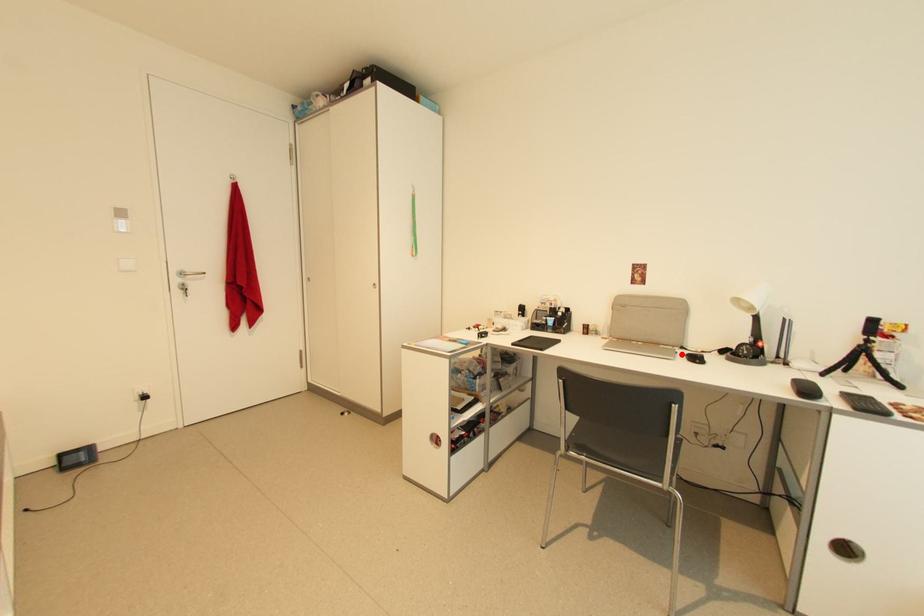
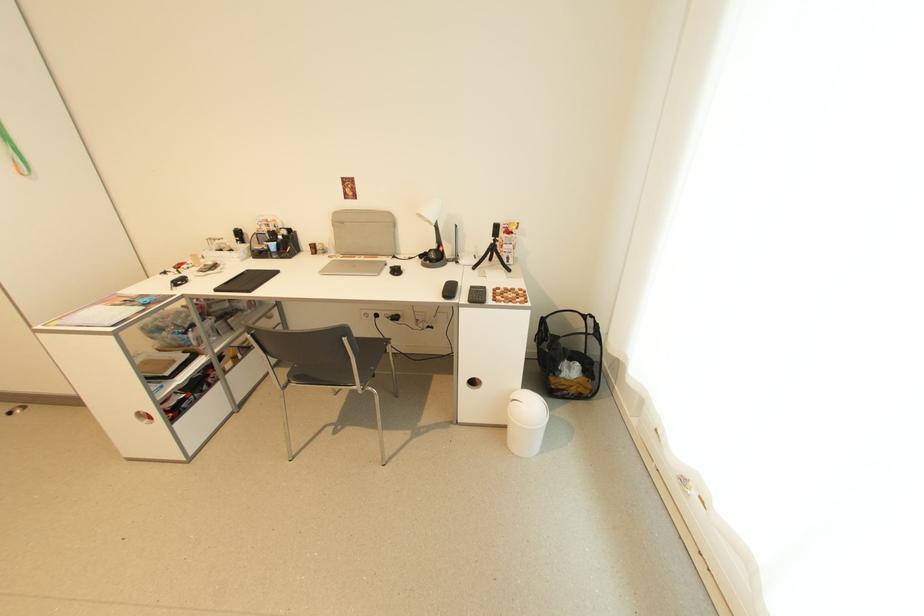
Where in the second image is the point corresponding to the highlighted location from the first image?

(391, 265)